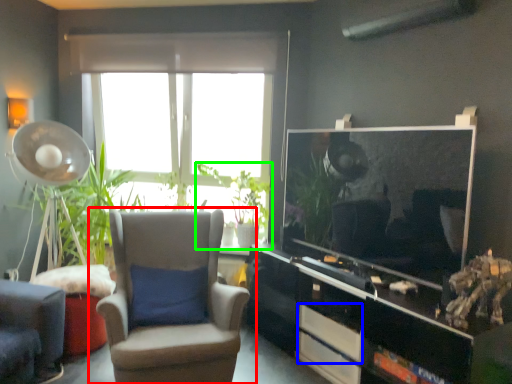
Question: Considering the real-world distances, which object is farthest from chair (highlighted by a red box)? drawer (highlighted by a blue box) or houseplant (highlighted by a green box)?

Choices:
 (A) drawer
 (B) houseplant

Answer: (B)